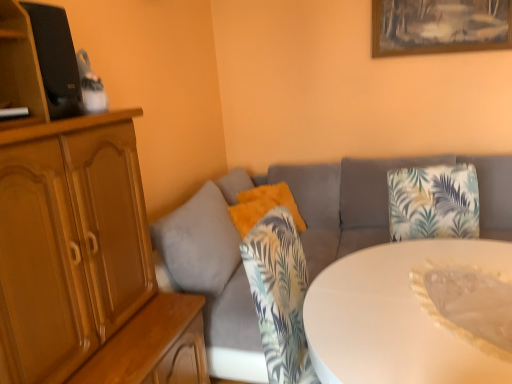
Question: Can you confirm if fuzzy orange pillow at center is taller than white glossy table at center?

Choices:
 (A) yes
 (B) no

Answer: (B)

Question: Is fuzzy orange pillow at center positioned in front of white glossy table at center?

Choices:
 (A) yes
 (B) no

Answer: (B)

Question: Could you tell me if fuzzy orange pillow at center is turned towards white glossy table at center?

Choices:
 (A) no
 (B) yes

Answer: (A)

Question: Is fuzzy orange pillow at center shorter than white glossy table at center?

Choices:
 (A) no
 (B) yes

Answer: (B)

Question: From a real-world perspective, is fuzzy orange pillow at center over white glossy table at center?

Choices:
 (A) yes
 (B) no

Answer: (A)

Question: Considering the relative sizes of fuzzy orange pillow at center and white glossy table at center in the image provided, is fuzzy orange pillow at center thinner than white glossy table at center?

Choices:
 (A) yes
 (B) no

Answer: (A)

Question: From the image's perspective, is white glossy table at center located above wooden cabinet at upper left?

Choices:
 (A) no
 (B) yes

Answer: (A)

Question: Is white glossy table at center at the left side of wooden cabinet at upper left?

Choices:
 (A) no
 (B) yes

Answer: (A)

Question: Could you tell me if white glossy table at center is facing wooden cabinet at upper left?

Choices:
 (A) no
 (B) yes

Answer: (A)

Question: Is the position of white glossy table at center less distant than that of wooden cabinet at upper left?

Choices:
 (A) yes
 (B) no

Answer: (A)

Question: Is white glossy table at center further to the viewer compared to wooden cabinet at upper left?

Choices:
 (A) no
 (B) yes

Answer: (A)

Question: Is white glossy table at center not inside wooden cabinet at upper left?

Choices:
 (A) yes
 (B) no

Answer: (A)

Question: Is white glossy table at center oriented away from fuzzy orange pillow at center?

Choices:
 (A) yes
 (B) no

Answer: (B)